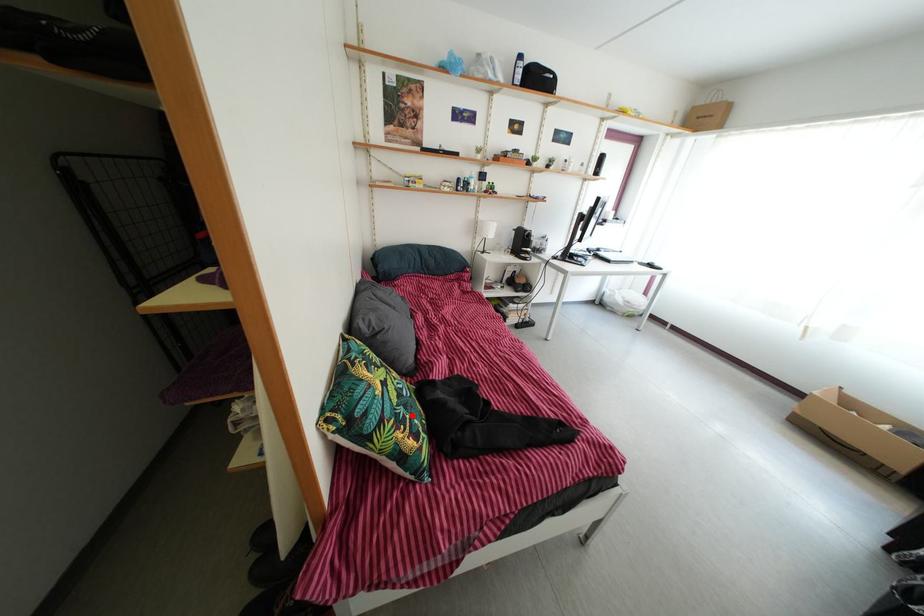
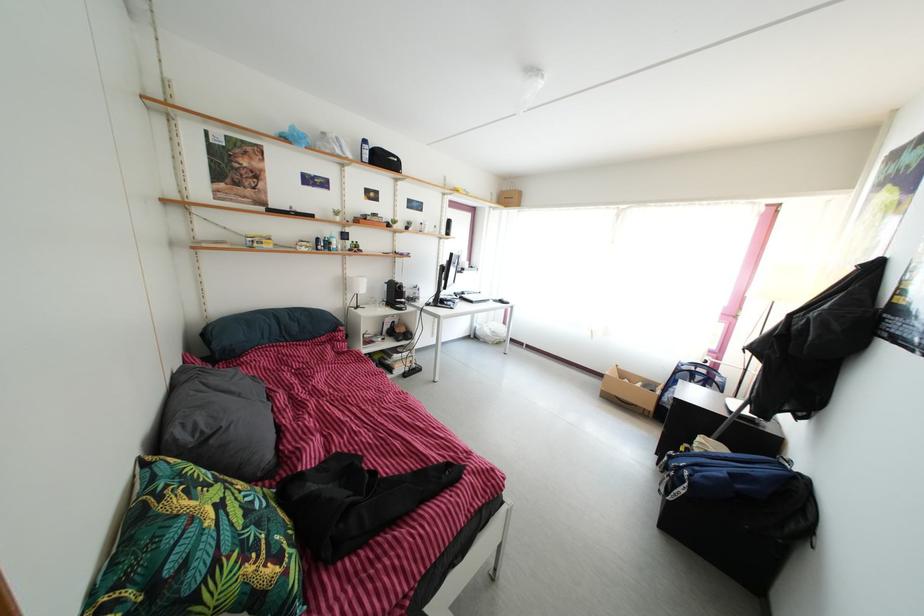
Where in the second image is the point corresponding to the highlighted location from the first image?

(264, 533)